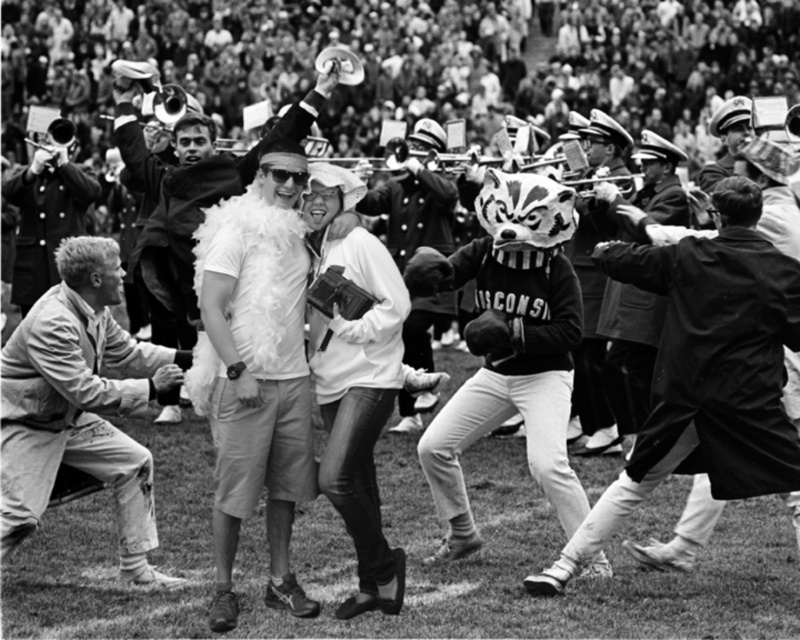
In the scene shown: You are a photographer at the event and need to decide which jacket to wear for better visibility. Considering the height difference between the light beige cotton jacket at lower left and the smooth leather jacket at left, which jacket would make you taller?

The smooth leather jacket at left is taller than the light beige cotton jacket at lower left, so wearing the smooth leather jacket at left would make you taller.

You are a photographer at the event and need to capture a photo of both the white fluffy boa at center and the smooth leather jacket at left. Based on their positions, which one is located to the right of the other?

The white fluffy boa at center is positioned on the right side of the smooth leather jacket at left.

You are a photographer at the event and need to capture both the white fluffy boa at center and the smooth leather jacket at left in a single frame. Based on their heights, which one might you position closer to the camera to ensure both are fully visible?

The white fluffy boa at center is shorter than the smooth leather jacket at left. To ensure both are fully visible, position the shorter white fluffy boa at center closer to the camera so its height matches the taller smooth leather jacket at left in the frame.